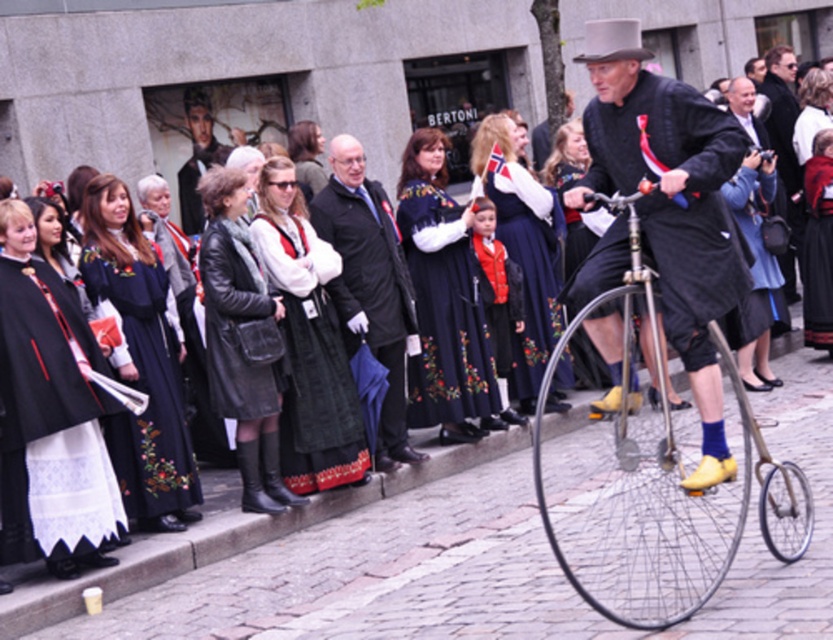
Can you confirm if cobblestone pavement at lower center is positioned below black wool coat at center?

Yes.

Is cobblestone pavement at lower center thinner than black wool coat at center?

Incorrect, cobblestone pavement at lower center's width is not less than black wool coat at center's.

At what (x,y) coordinates should I click in order to perform the action: click on cobblestone pavement at lower center. Please return your answer as a coordinate pair (x, y). Looking at the image, I should click on (377, 576).

Who is shorter, shiny silver bicycle at right or black wool coat at center?

With less height is shiny silver bicycle at right.

Which of these two, shiny silver bicycle at right or black wool coat at center, stands taller?

black wool coat at center

Who is more distant from viewer, (626, 428) or (348, 148)?

The point (348, 148) is behind.

The width and height of the screenshot is (833, 640). In order to click on shiny silver bicycle at right in this screenshot , I will do `click(644, 509)`.

Which of these two, cobblestone pavement at lower center or metallic silver bicycle wheel at center, stands shorter?

cobblestone pavement at lower center is shorter.

Is cobblestone pavement at lower center further to camera compared to metallic silver bicycle wheel at center?

That is False.

Where is `cobblestone pavement at lower center`? This screenshot has width=833, height=640. cobblestone pavement at lower center is located at coordinates (377, 576).